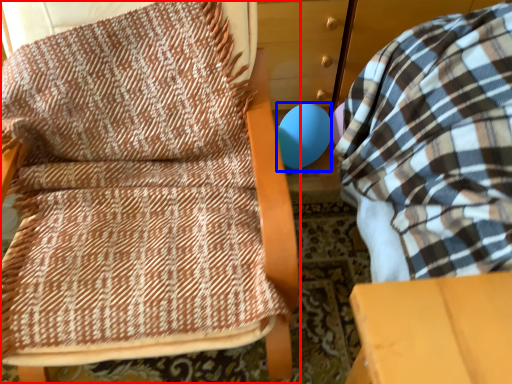
Question: Which of the following is the closest to the observer, furniture (highlighted by a red box) or balloon (highlighted by a blue box)?

Choices:
 (A) furniture
 (B) balloon

Answer: (A)